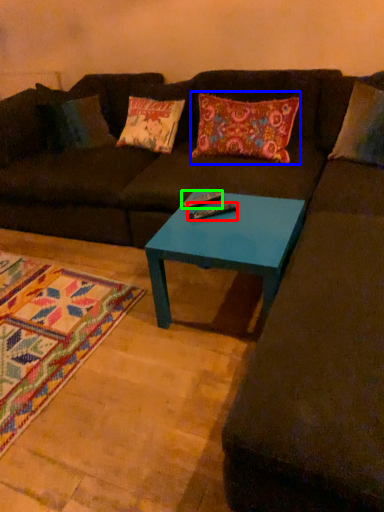
Question: Based on their relative distances, which object is farther from remote (highlighted by a red box)? Choose from throw pillow (highlighted by a blue box) and remote (highlighted by a green box).

Choices:
 (A) throw pillow
 (B) remote

Answer: (A)